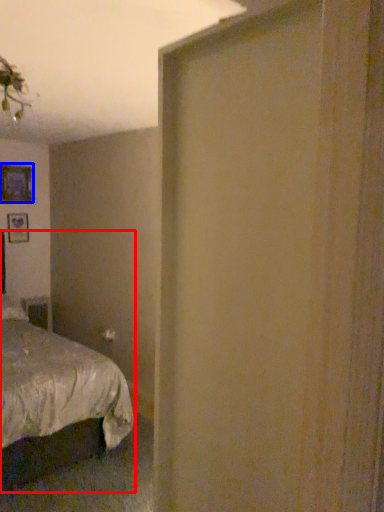
Question: Which object is further to the camera taking this photo, bed (highlighted by a red box) or picture frame (highlighted by a blue box)?

Choices:
 (A) bed
 (B) picture frame

Answer: (B)